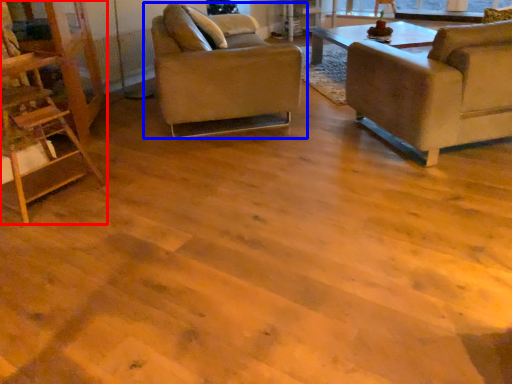
Question: Which point is further to the camera, ladder (highlighted by a red box) or chair (highlighted by a blue box)?

Choices:
 (A) ladder
 (B) chair

Answer: (B)